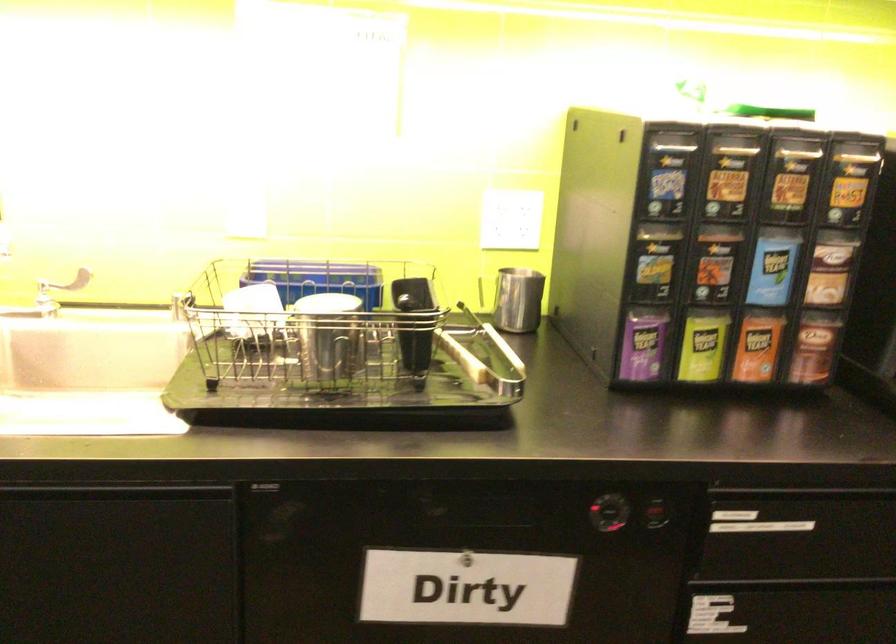
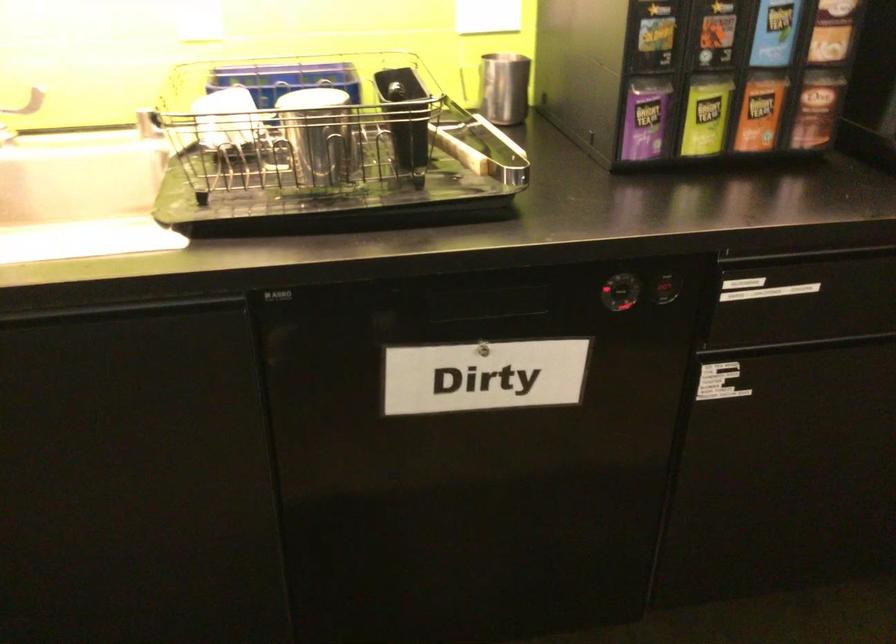
Find the pixel in the second image that matches the point at 609,512 in the first image.

(623, 290)